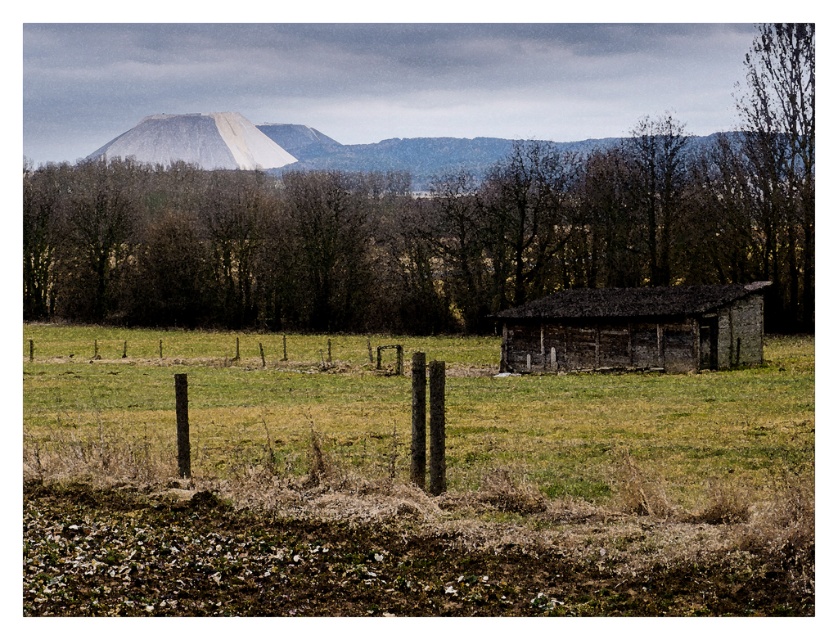
Is white smooth mountain at upper center closer to camera compared to brown wooden fence at center?

No, it is not.

Which is behind, point (278, 132) or point (39, 332)?

Positioned behind is point (278, 132).

Identify the location of white smooth mountain at upper center. The width and height of the screenshot is (838, 640). (299, 148).

Between white smooth mountain at upper center and white matte mountain at upper center, which one appears on the left side from the viewer's perspective?

white matte mountain at upper center

Between white smooth mountain at upper center and white matte mountain at upper center, which one is positioned lower?

white smooth mountain at upper center is lower down.

Where is `white smooth mountain at upper center`? white smooth mountain at upper center is located at coordinates (299, 148).

Is green grass at center shorter than white matte mountain at upper center?

Correct, green grass at center is not as tall as white matte mountain at upper center.

Is green grass at center bigger than white matte mountain at upper center?

Incorrect, green grass at center is not larger than white matte mountain at upper center.

Between point (784, 397) and point (278, 154), which one is positioned in front?

Positioned in front is point (784, 397).

This screenshot has height=640, width=838. Identify the location of green grass at center. (409, 413).